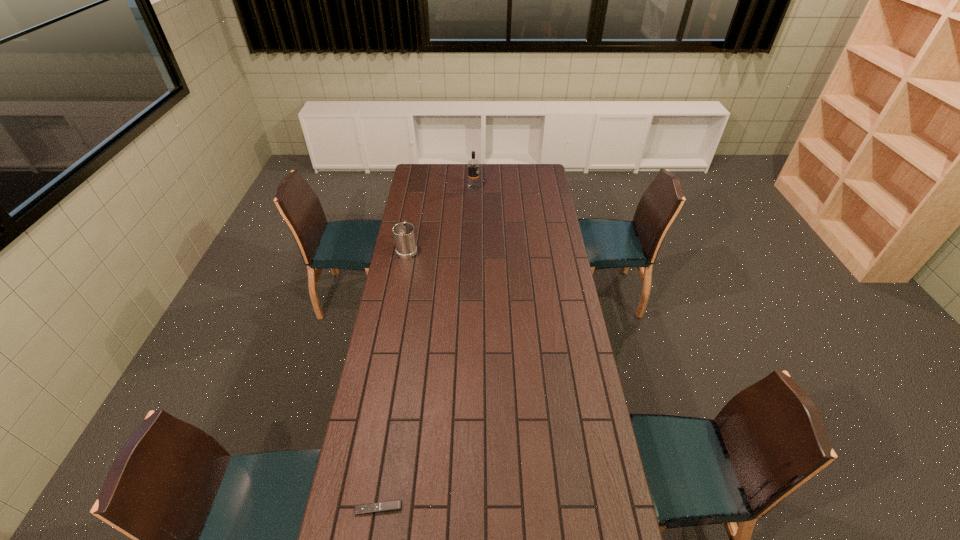
Locate an element on the screen. free spot between the nearest object and the second tallest object is located at coordinates (393, 379).

The width and height of the screenshot is (960, 540). In order to click on vacant space that's between the second shortest object and the remote control in this screenshot , I will do `click(393, 379)`.

Locate an element on the screen. This screenshot has height=540, width=960. vacant point located between the second farthest object and the rightmost object is located at coordinates [x=441, y=219].

Identify which object is the second nearest to the second shortest object. Please provide its 2D coordinates. Your answer should be formatted as a tuple, i.e. [(x, y)], where the tuple contains the x and y coordinates of a point satisfying the conditions above.

[(387, 506)]

Where is `the second closest object to the rightmost object`? Image resolution: width=960 pixels, height=540 pixels. the second closest object to the rightmost object is located at coordinates (387, 506).